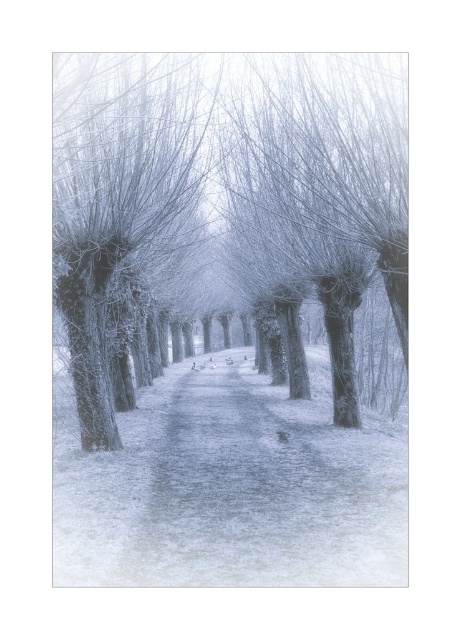
Question: Observing the image, what is the correct spatial positioning of smooth bark trees at center in reference to smooth bark tree at center?

Choices:
 (A) left
 (B) right

Answer: (B)

Question: Which object appears closest to the camera in this image?

Choices:
 (A) smooth bark tree at center
 (B) snowy gravel path at center
 (C) smooth bark trees at center

Answer: (C)

Question: Can you confirm if snowy gravel path at center is smaller than smooth bark tree at center?

Choices:
 (A) yes
 (B) no

Answer: (A)

Question: Among these objects, which one is nearest to the camera?

Choices:
 (A) snowy gravel path at center
 (B) smooth bark tree at center
 (C) smooth bark trees at center

Answer: (C)

Question: Among these points, which one is nearest to the camera?

Choices:
 (A) (205, 152)
 (B) (98, 301)
 (C) (212, 381)

Answer: (B)

Question: Does snowy gravel path at center have a smaller size compared to smooth bark tree at center?

Choices:
 (A) yes
 (B) no

Answer: (A)